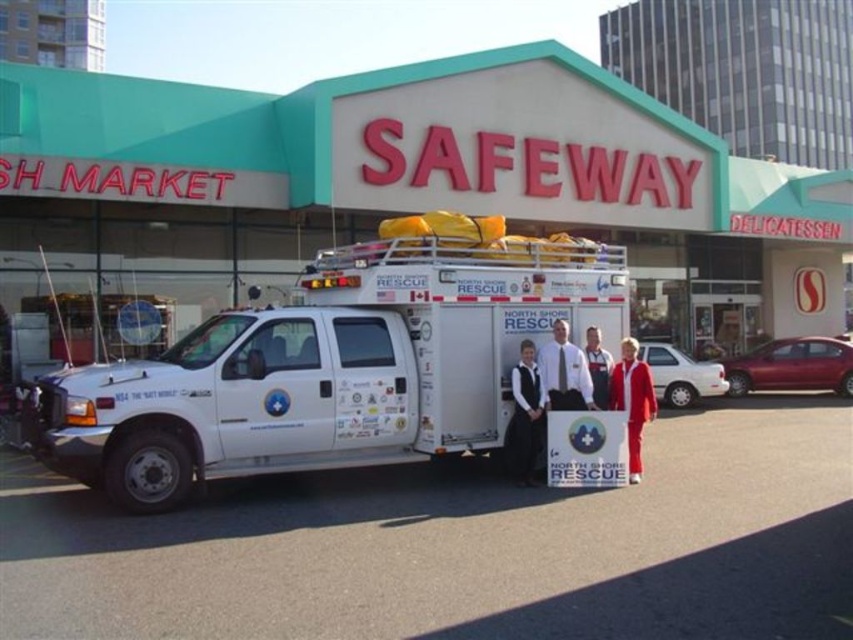
You are a delivery driver who needs to park your truck near the Safeway store. The parking lot has a restricted area marked at point 0.573, 0.930. Is the white matte van at center currently blocking your parking spot?

The white matte van at center is located at point [792,365], which matches the restricted area coordinates. Therefore, the van is blocking the parking spot.

You are a fashion designer observing the image of a black fabric dress at center and a white fabric shirt at center. Which clothing item has a greater width?

The black fabric dress at center has a greater width than the white fabric shirt at center.